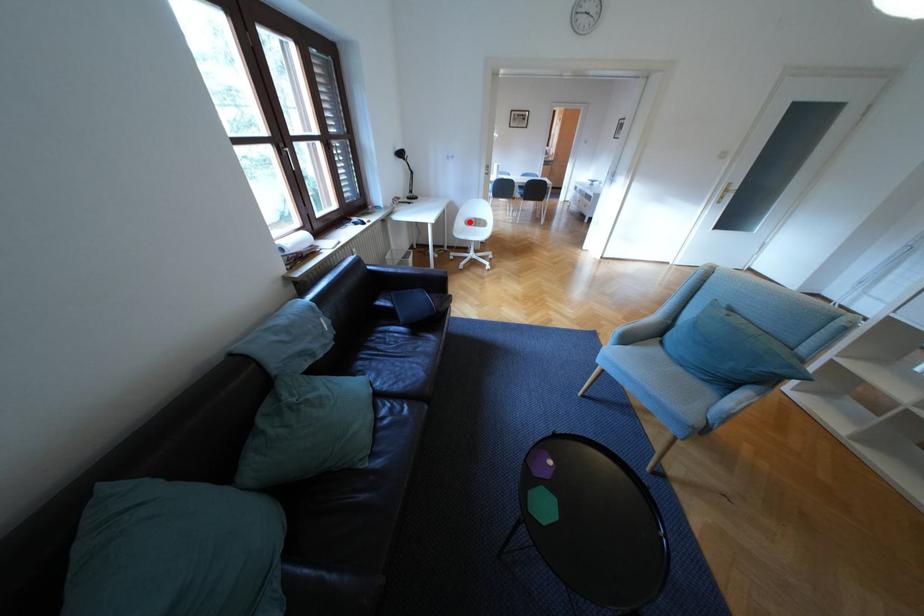
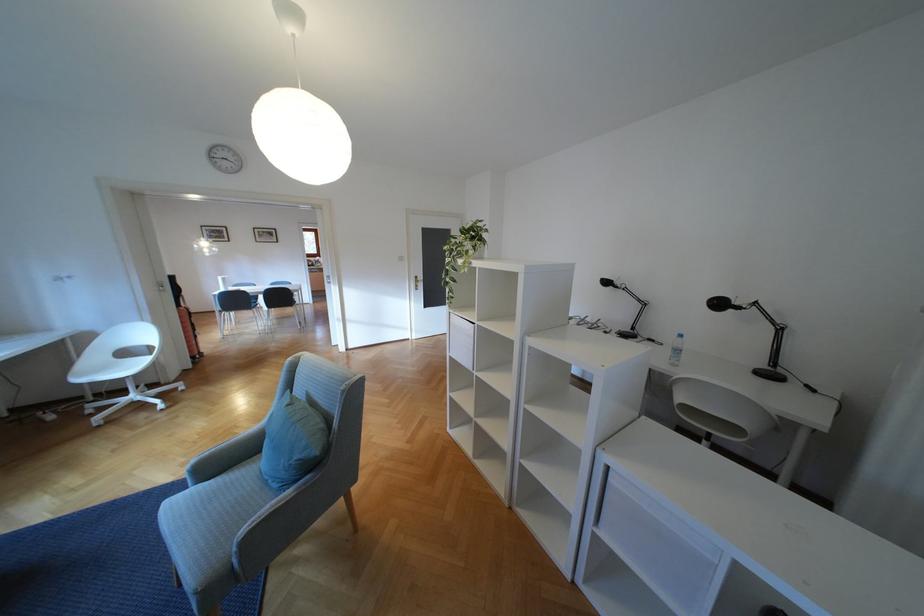
Question: I am providing you with two images of the same scene from different viewpoints. A red point is shown in image1. For the corresponding object point in image2, is it positioned nearer or farther from the camera?

Choices:
 (A) Nearer
 (B) Farther

Answer: (B)